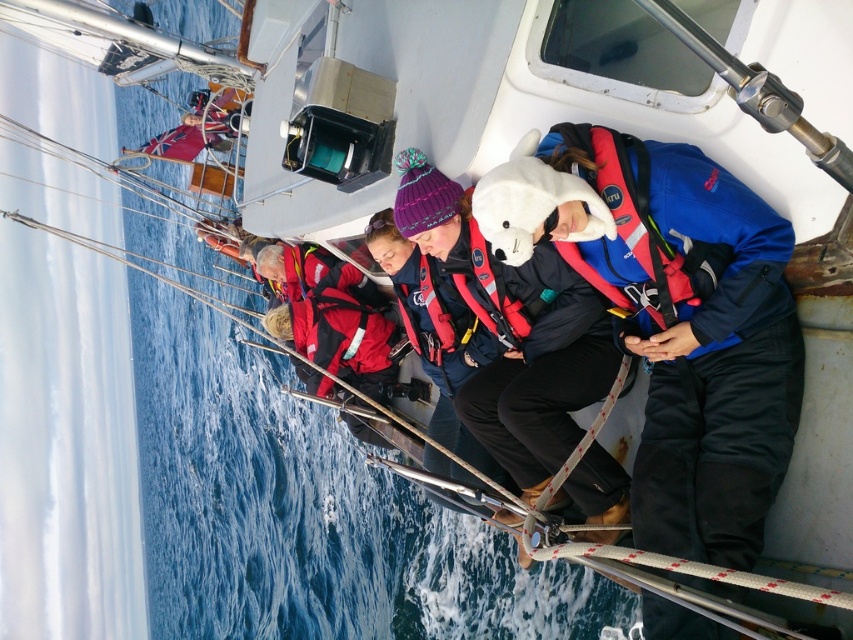
In the scene shown: Is blue fleece jacket at center above blue fabric life jacket at upper right?

No.

Does blue fleece jacket at center have a smaller size compared to blue fabric life jacket at upper right?

Incorrect, blue fleece jacket at center is not smaller in size than blue fabric life jacket at upper right.

The width and height of the screenshot is (853, 640). Describe the element at coordinates (672, 317) in the screenshot. I see `blue fleece jacket at center` at that location.

I want to click on blue fleece jacket at center, so click(x=672, y=317).

Who is positioned more to the left, blue fleece jacket at center or red matte life jacket at center?

red matte life jacket at center

Between blue fleece jacket at center and red matte life jacket at center, which one has more height?

With more height is blue fleece jacket at center.

This screenshot has height=640, width=853. Find the location of `blue fleece jacket at center`. blue fleece jacket at center is located at coordinates (672, 317).

Is point (650, 262) less distant than point (386, 305)?

Yes, it is in front of point (386, 305).

Is blue fabric life jacket at upper right behind red matte life jacket at center?

No, blue fabric life jacket at upper right is closer to the viewer.

Consider the image. Who is more distant from viewer, (581, 129) or (323, 282)?

The point (323, 282) is more distant.

Where is `blue fabric life jacket at upper right`? The height and width of the screenshot is (640, 853). blue fabric life jacket at upper right is located at coordinates (630, 225).